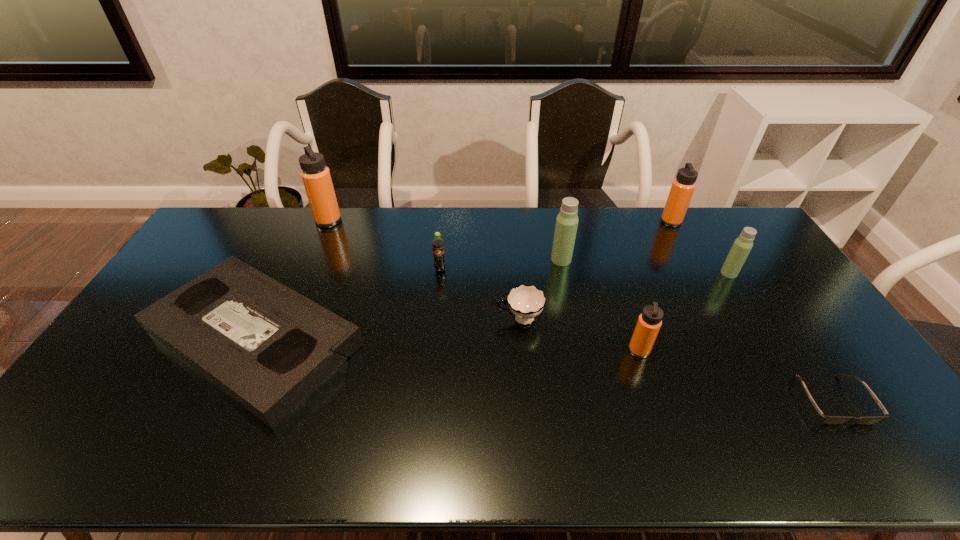
Where is `soda`? soda is located at coordinates (438, 244).

Find the location of a particular element. This screenshot has width=960, height=540. green soda is located at coordinates (438, 244).

Locate an element on the screen. This screenshot has height=540, width=960. the sixth object from right to left is located at coordinates coord(525,302).

The height and width of the screenshot is (540, 960). In order to click on the third shortest object in this screenshot , I will do `click(525, 302)`.

The image size is (960, 540). What are the coordinates of `the eighth tallest object` in the screenshot? It's located at [x=269, y=348].

Image resolution: width=960 pixels, height=540 pixels. What are the coordinates of `black sunglasses` in the screenshot? It's located at (828, 420).

You are a GUI agent. You are given a task and a screenshot of the screen. Output one action in this format:
    pyautogui.click(x=<x>, y=<y>)
    Task: Click on the sunglasses
    The width and height of the screenshot is (960, 540).
    Given the screenshot: What is the action you would take?
    pyautogui.click(x=828, y=420)

Where is `free space located on the left of the tallest thermos bottle`? free space located on the left of the tallest thermos bottle is located at coordinates (293, 221).

Find the location of `free space located on the right of the rightmost orange thermos bottle`. free space located on the right of the rightmost orange thermos bottle is located at coordinates (744, 222).

Locate an element on the screen. free space located 0.330m on the front of the fifth object from left to right is located at coordinates (578, 343).